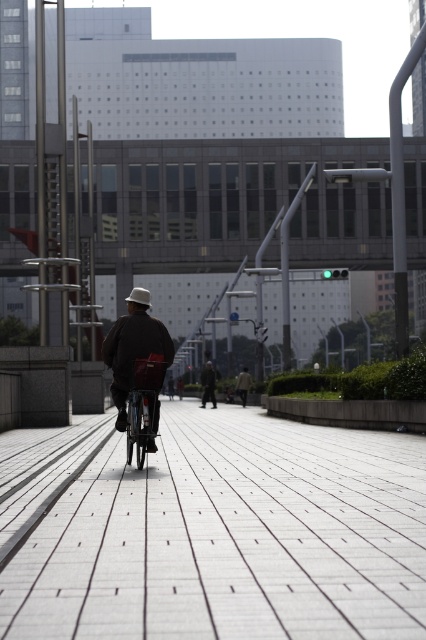
You are a GUI agent. You are given a task and a screenshot of the screen. Output one action in this format:
    pyautogui.click(x=<x>, y=<y>)
    Task: Click on the gray concrete pavement at center
    This screenshot has height=640, width=426.
    Given the screenshot: What is the action you would take?
    pyautogui.click(x=230, y=538)

Is gray concrete pavement at center further to the viewer compared to light brown leather jacket at center?

No, gray concrete pavement at center is closer to the viewer.

What do you see at coordinates (230, 538) in the screenshot?
I see `gray concrete pavement at center` at bounding box center [230, 538].

Locate an element on the screen. The width and height of the screenshot is (426, 640). gray concrete pavement at center is located at coordinates (230, 538).

Can you confirm if gray concrete pavement at center is smaller than dark gray fabric jacket at center?

No, gray concrete pavement at center is not smaller than dark gray fabric jacket at center.

Is gray concrete pavement at center further to the viewer compared to dark gray fabric jacket at center?

No.

Who is more forward, (x=11, y=636) or (x=201, y=397)?

Point (x=11, y=636) is more forward.

You are a GUI agent. You are given a task and a screenshot of the screen. Output one action in this format:
    pyautogui.click(x=<x>, y=<y>)
    Task: Click on the gray concrete pavement at center
    The image size is (426, 640).
    Given the screenshot: What is the action you would take?
    pyautogui.click(x=230, y=538)

Is gray concrete pavement at center bigger than dark brown leather jacket at center?

Yes, gray concrete pavement at center is bigger than dark brown leather jacket at center.

Can you confirm if gray concrete pavement at center is thinner than dark brown leather jacket at center?

Incorrect, gray concrete pavement at center's width is not less than dark brown leather jacket at center's.

What do you see at coordinates (230, 538) in the screenshot?
I see `gray concrete pavement at center` at bounding box center [230, 538].

Identify the location of gray concrete pavement at center. (230, 538).